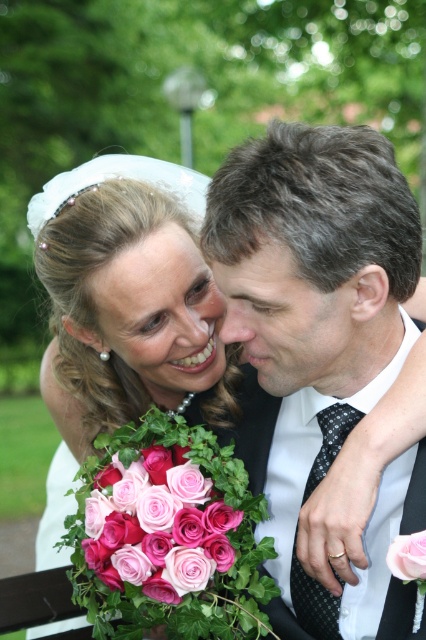
You are standing at the point marked as point (138,461) in the image. You want to take a photo of the bride and groom without any obstructions. Is there enough space between you and the couple to avoid blocking their view?

The distance between you and the couple at point (138,461) is 1.21 meters, which should provide sufficient space to take a photo without obstructing their view.

You are a photographer adjusting your camera settings to capture the details of the smooth skin at center and the pink matte rose at center. Which object should you focus on first to ensure clarity in your photo?

The smooth skin at center is further to the viewer than the pink matte rose at center, so you should focus on the smooth skin at center first to ensure clarity.